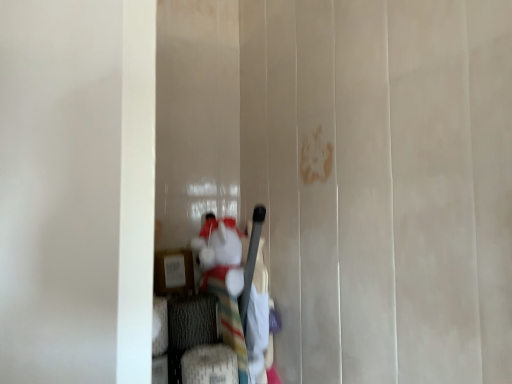
Image resolution: width=512 pixels, height=384 pixels. Find the location of `white plush toy at center`. white plush toy at center is located at coordinates (233, 280).

This screenshot has height=384, width=512. Describe the element at coordinates (233, 280) in the screenshot. I see `white plush toy at center` at that location.

Measure the distance between point (225, 250) and camera.

The distance of point (225, 250) from camera is 1.03 meters.

Identify the location of white plush toy at center. The image size is (512, 384). (233, 280).